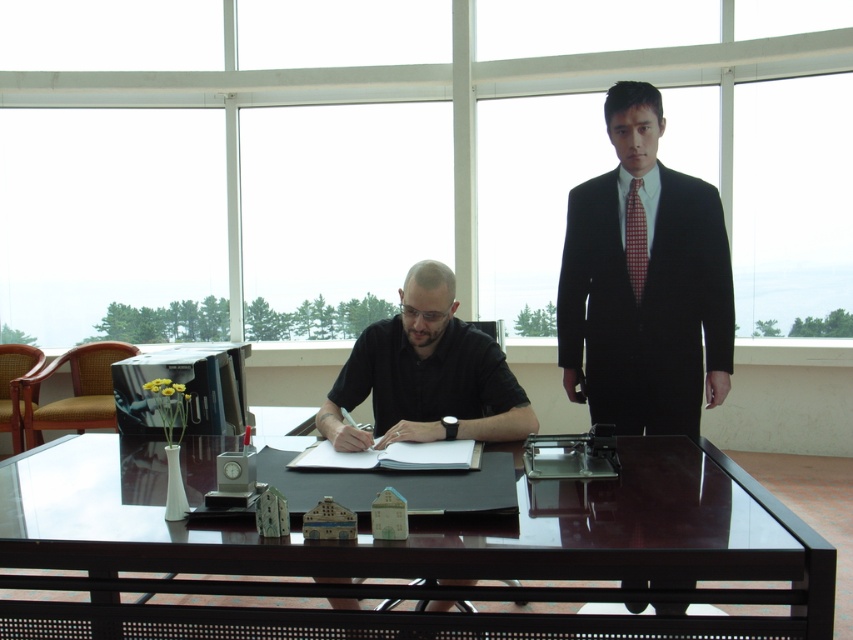
In the scene shown: You are an interior designer assessing the office layout. The black smooth shirt at center and the red checkered tie at right are both visible in the scene. Which of these items is larger in size?

The black smooth shirt at center is bigger than the red checkered tie at right.

You are a delivery person entering the office and need to place a package on the glossy dark wood table at center and the matte black suit at right. Which surface is shorter and thus safer to place the package without needing a ladder?

The glossy dark wood table at center is shorter than the matte black suit at right, so it is safer to place the package there without needing a ladder.